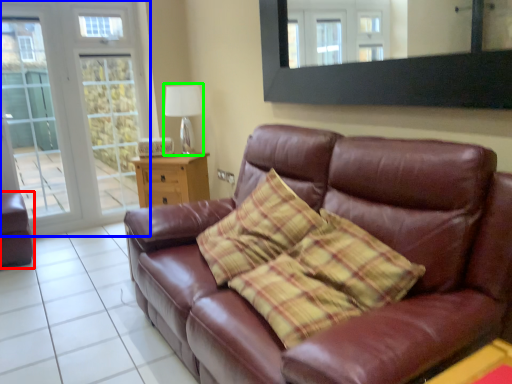
Question: Which object is positioned farthest from armchair (highlighted by a red box)? Select from glass door (highlighted by a blue box) and lamp (highlighted by a green box).

Choices:
 (A) glass door
 (B) lamp

Answer: (B)